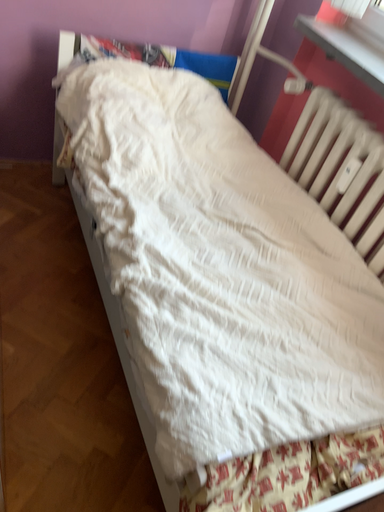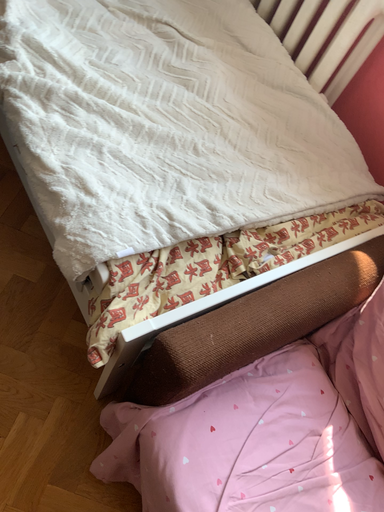
Question: How did the camera likely rotate when shooting the video?

Choices:
 (A) rotated left
 (B) rotated right

Answer: (B)